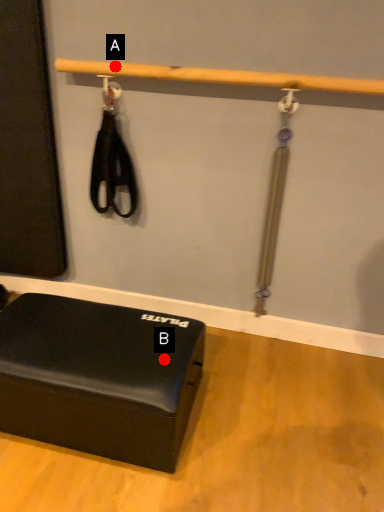
Question: Two points are circled on the image, labeled by A and B beside each circle. Which of the following is the closest to the observer?

Choices:
 (A) A is closer
 (B) B is closer

Answer: (B)